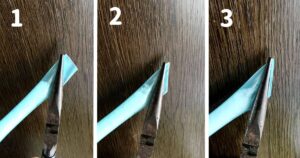
Locate an element on the screen. The width and height of the screenshot is (300, 158). surface is located at coordinates (238, 62).